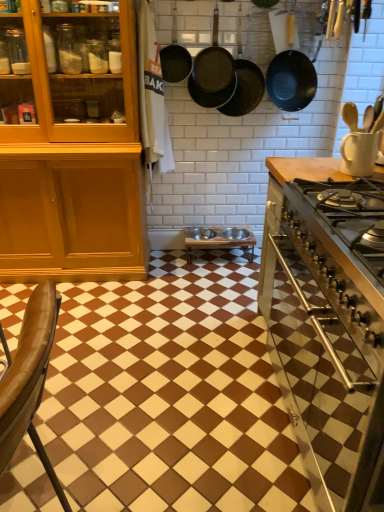
Locate an element on the screen. The image size is (384, 512). vacant area on top of brown glossy tile at center (from a real-world perspective) is located at coordinates (151, 342).